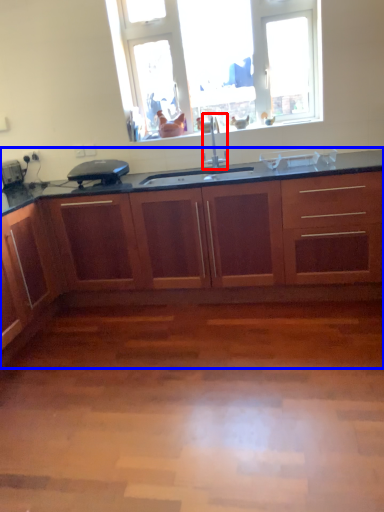
Question: Which object is closer to the camera taking this photo, faucet (highlighted by a red box) or cabinetry (highlighted by a blue box)?

Choices:
 (A) faucet
 (B) cabinetry

Answer: (B)